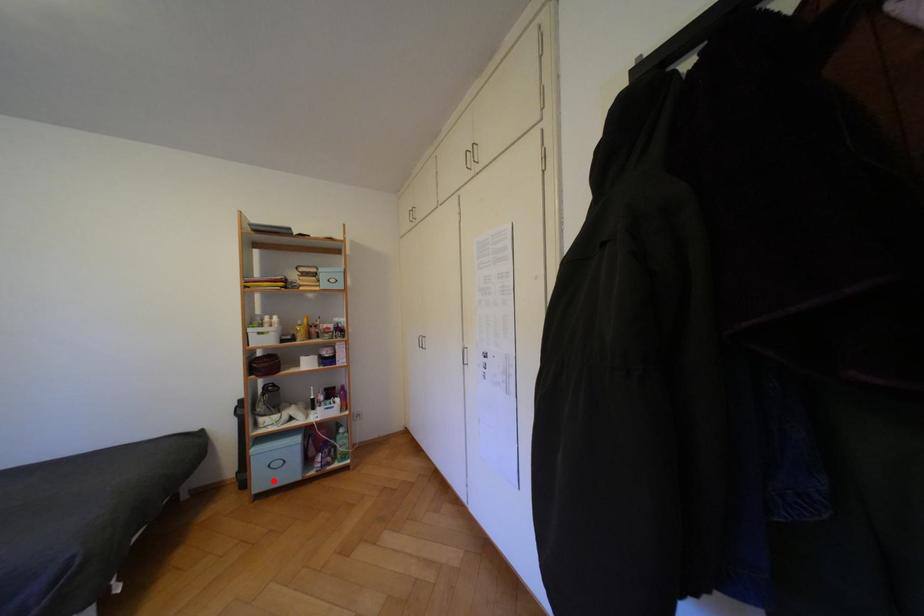
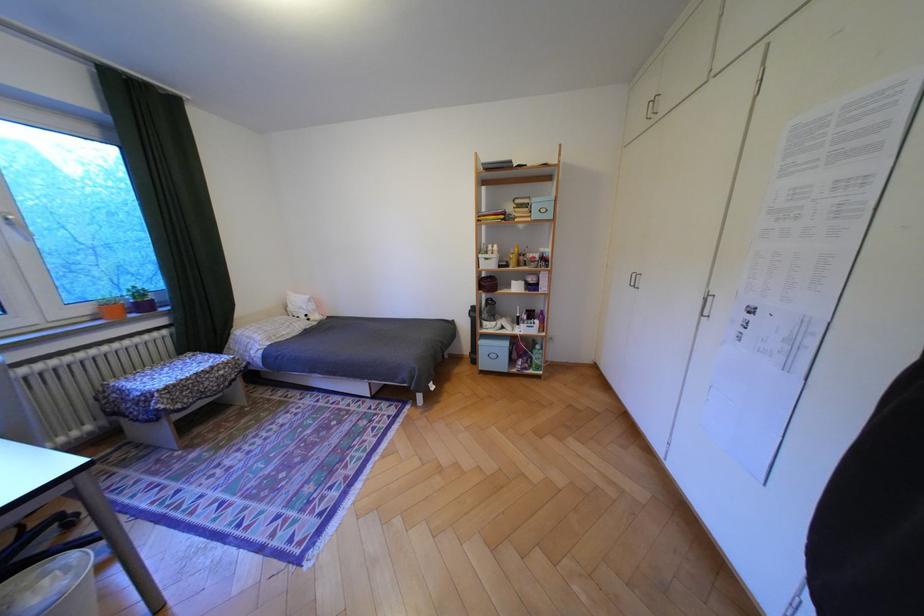
In the second image, find the point that corresponds to the highlighted location in the first image.

(495, 363)